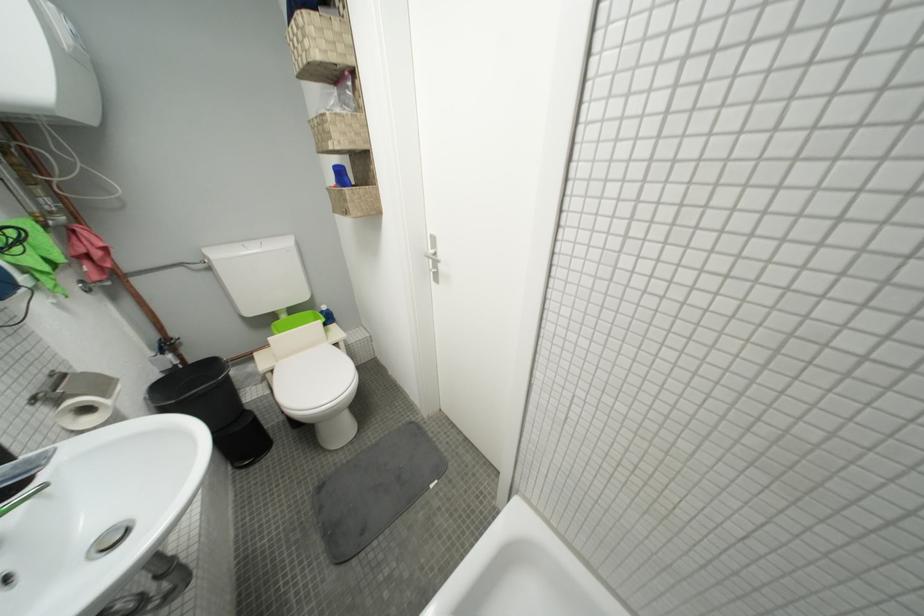
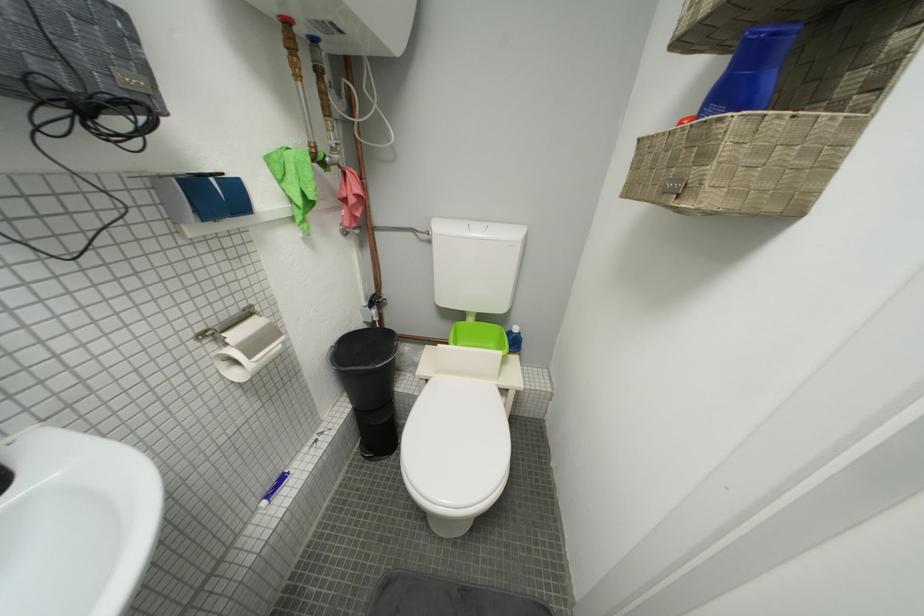
Question: The first image is from the beginning of the video and the second image is from the end. How did the camera likely rotate when shooting the video?

Choices:
 (A) Left
 (B) Right
 (C) Up
 (D) Down

Answer: (A)